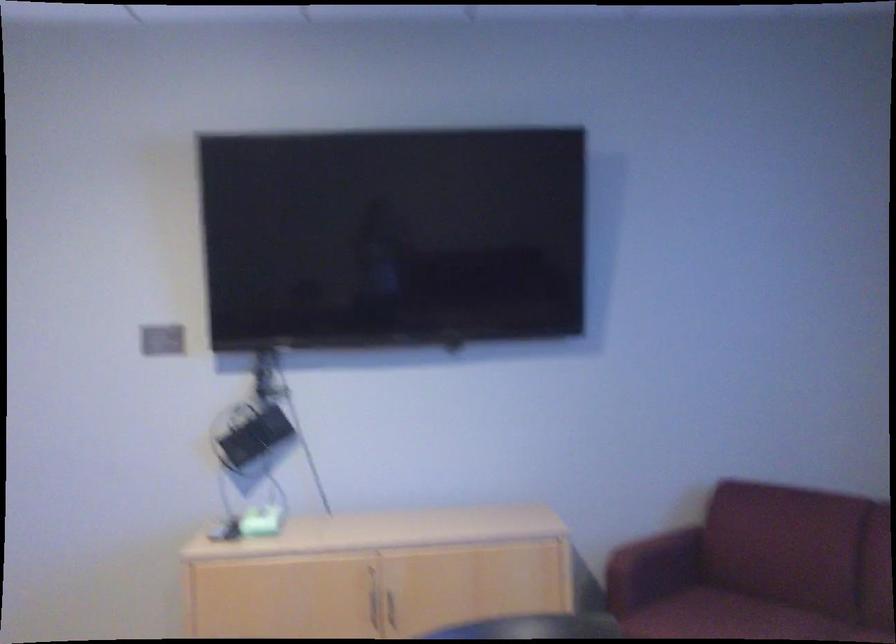
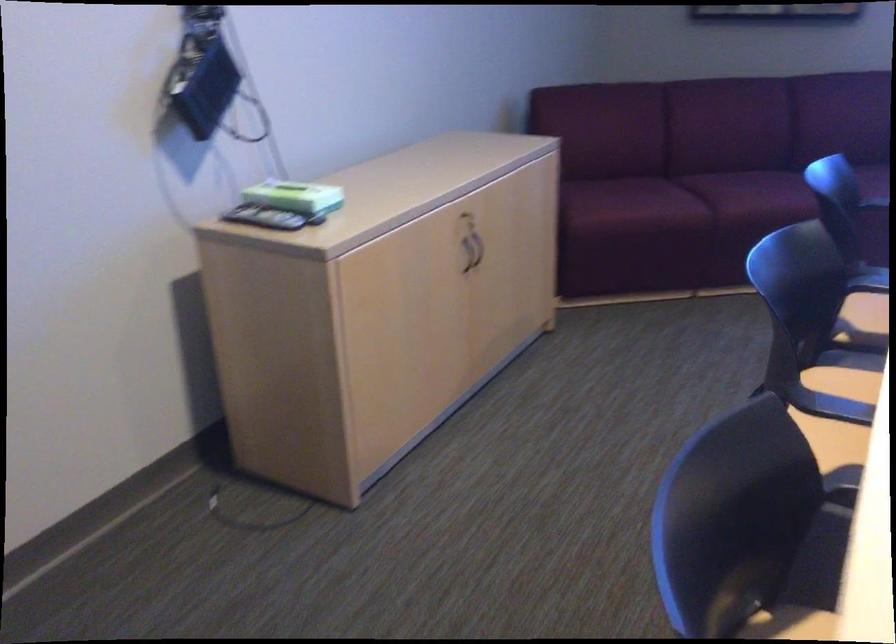
Locate, in the second image, the point that corresponds to the point at 251,516 in the first image.

(287, 196)